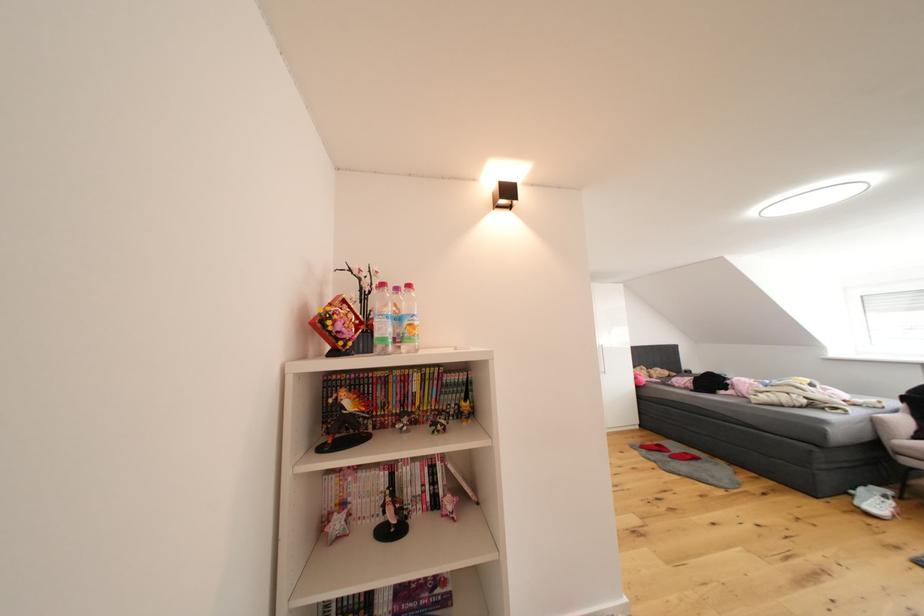
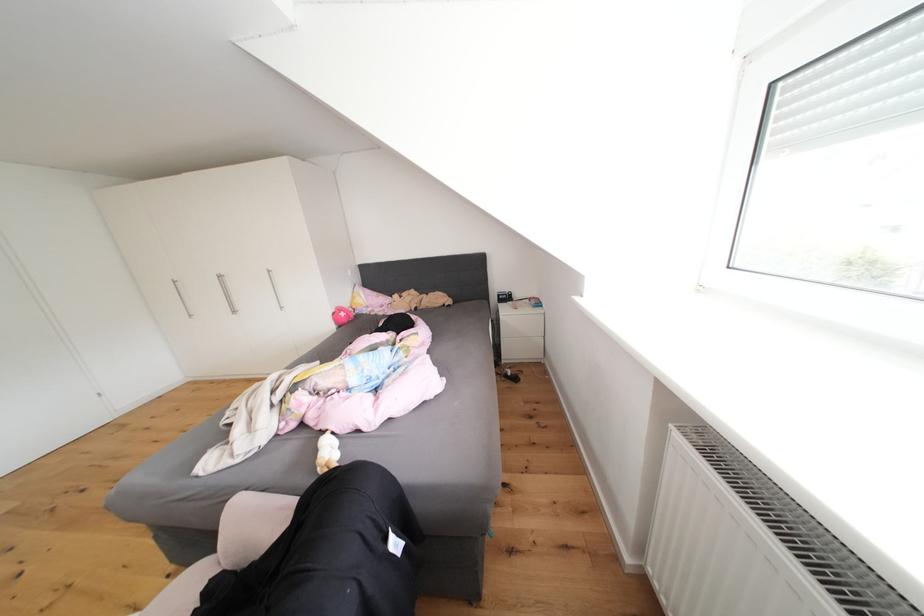
The point at (x=645, y=382) is marked in the first image. Where is the corresponding point in the second image?

(343, 318)